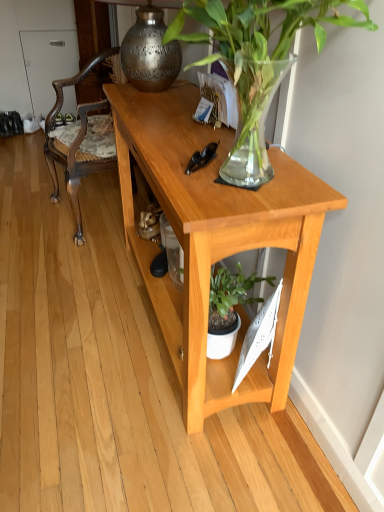
Where is `free area behind green glossy plant at upper center`? The width and height of the screenshot is (384, 512). free area behind green glossy plant at upper center is located at coordinates (169, 126).